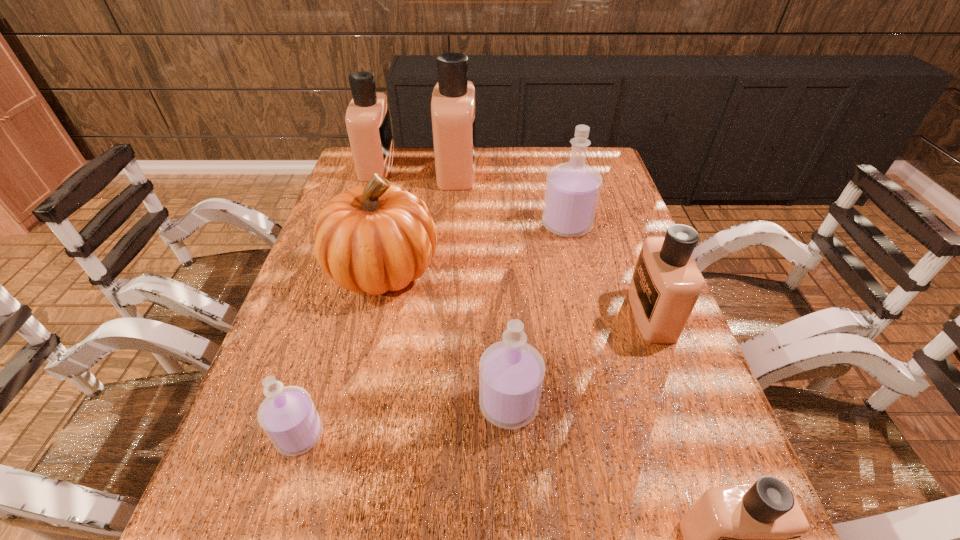
The width and height of the screenshot is (960, 540). I want to click on pumpkin situated at the left edge, so [x=380, y=237].

Where is `object positioned at the far left corner`? object positioned at the far left corner is located at coordinates (367, 118).

You are a GUI agent. You are given a task and a screenshot of the screen. Output one action in this format:
    pyautogui.click(x=<x>, y=<y>)
    Task: Click on the free space at the far edge of the desktop
    The image size is (960, 540).
    Given the screenshot: What is the action you would take?
    pyautogui.click(x=478, y=154)

Identify the location of vacant space at the left edge of the desktop. (317, 268).

Locate an element on the screen. The height and width of the screenshot is (540, 960). blank space at the right edge is located at coordinates (613, 214).

You are a GUI agent. You are given a task and a screenshot of the screen. Output one action in this format:
    pyautogui.click(x=<x>, y=<y>)
    Task: Click on the free spot between the smallest purple perfume and the biggest beige perfume
    Image resolution: width=960 pixels, height=540 pixels.
    Given the screenshot: What is the action you would take?
    pyautogui.click(x=378, y=302)

The image size is (960, 540). I want to click on vacant area that lies between the leftmost beige perfume and the tallest perfume, so click(417, 167).

Find the location of a particular element. Image resolution: width=960 pixels, height=540 pixels. blank region between the fourth object from right to left and the second beige perfume from left to right is located at coordinates (483, 287).

Identify the location of free space between the fourth nearest perfume and the leftmost purple perfume. This screenshot has height=540, width=960. (475, 375).

Where is `free point between the biggest beige perfume and the third biggest beige perfume`? The image size is (960, 540). free point between the biggest beige perfume and the third biggest beige perfume is located at coordinates (554, 242).